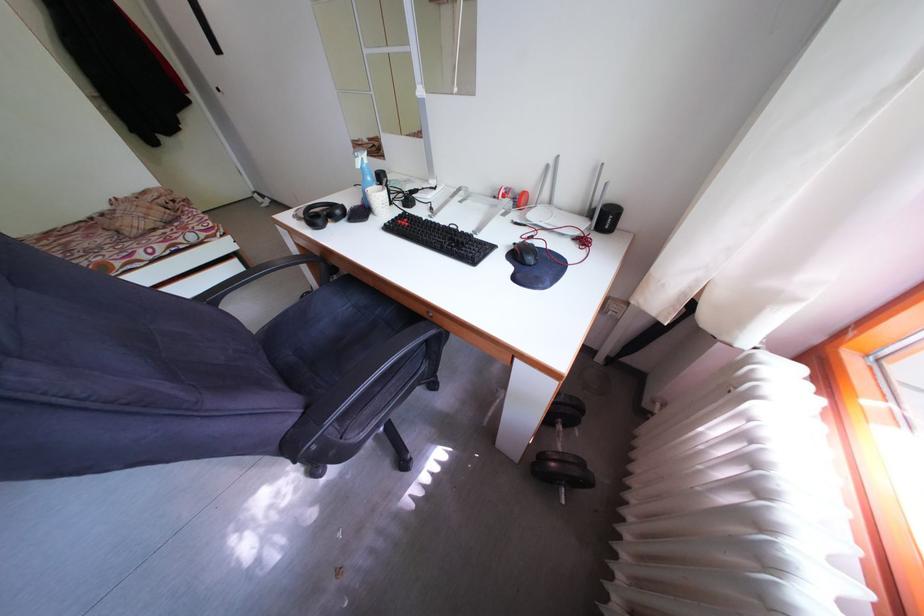
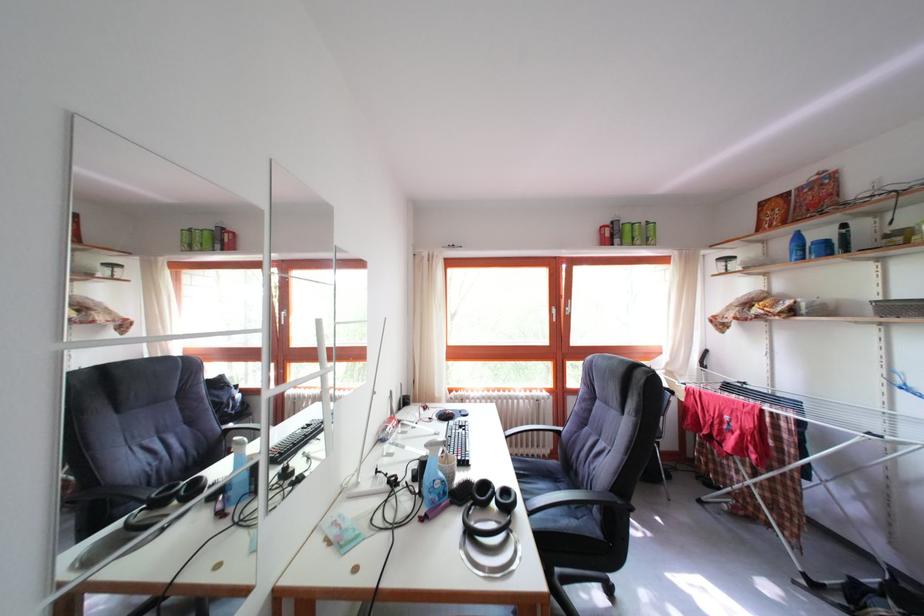
Where in the second image is the point corresponding to pixel 321 223 from the first image?

(517, 506)